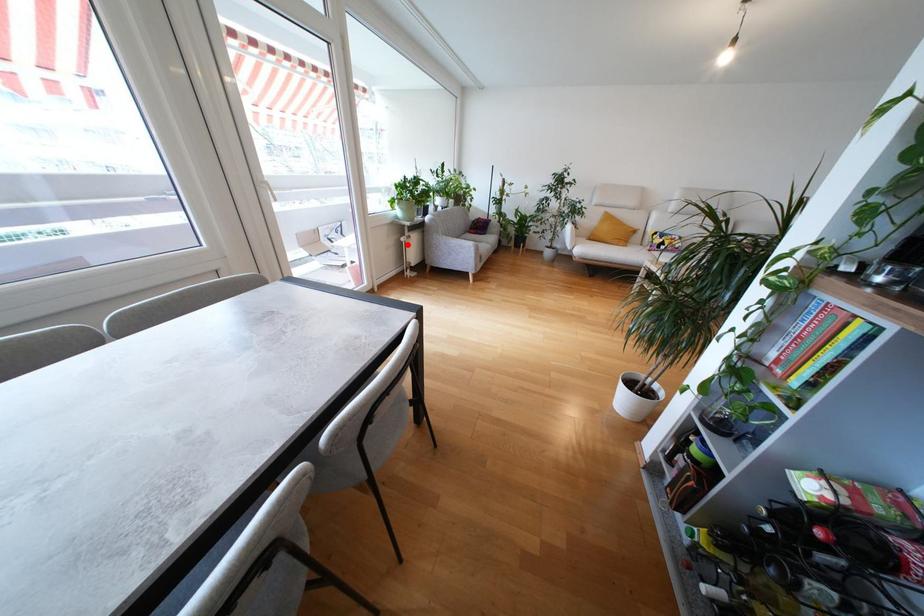
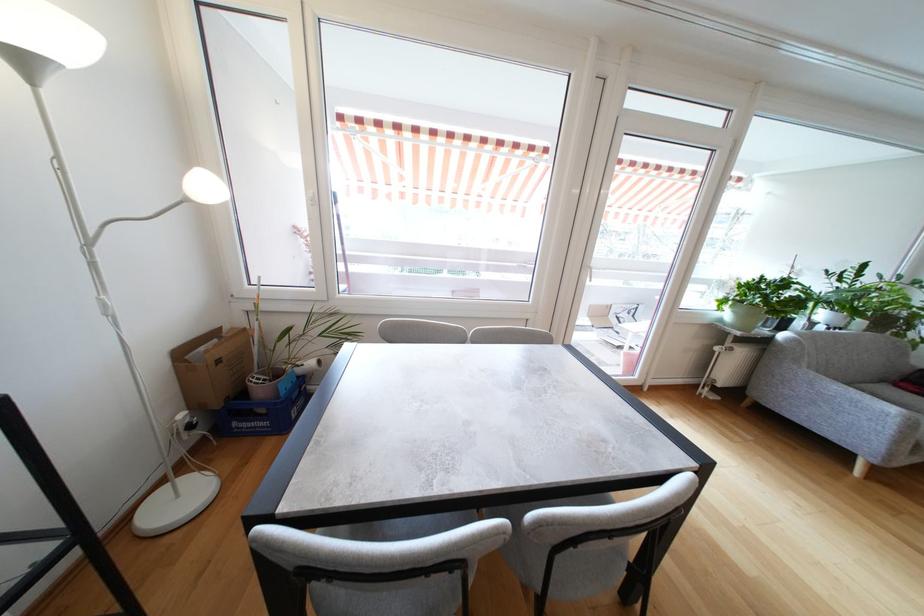
Question: I am providing you with two images of the same scene from different viewpoints. Given a red point in image1, look at the same physical point in image2. Is it:

Choices:
 (A) Closer to the viewpoint
 (B) Farther from the viewpoint

Answer: (B)